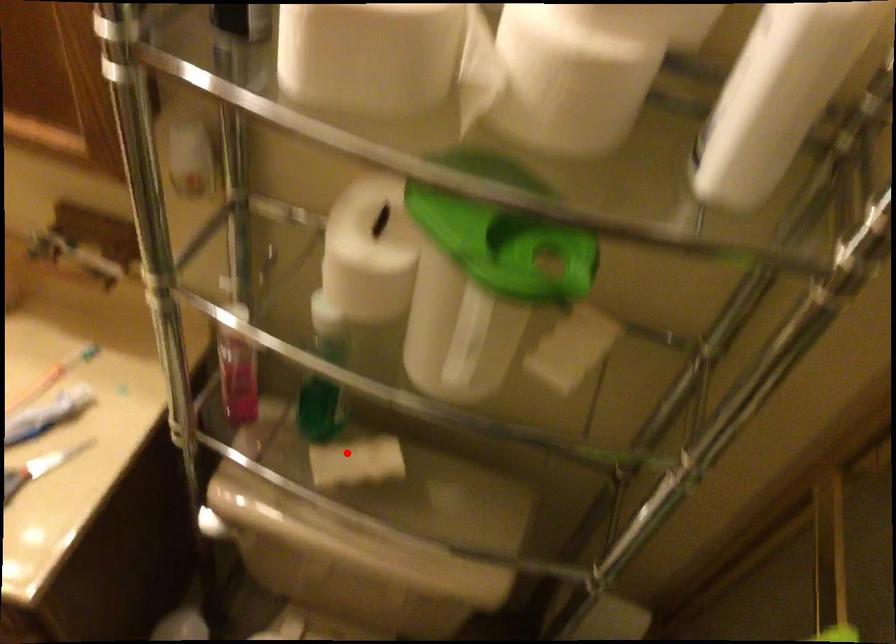
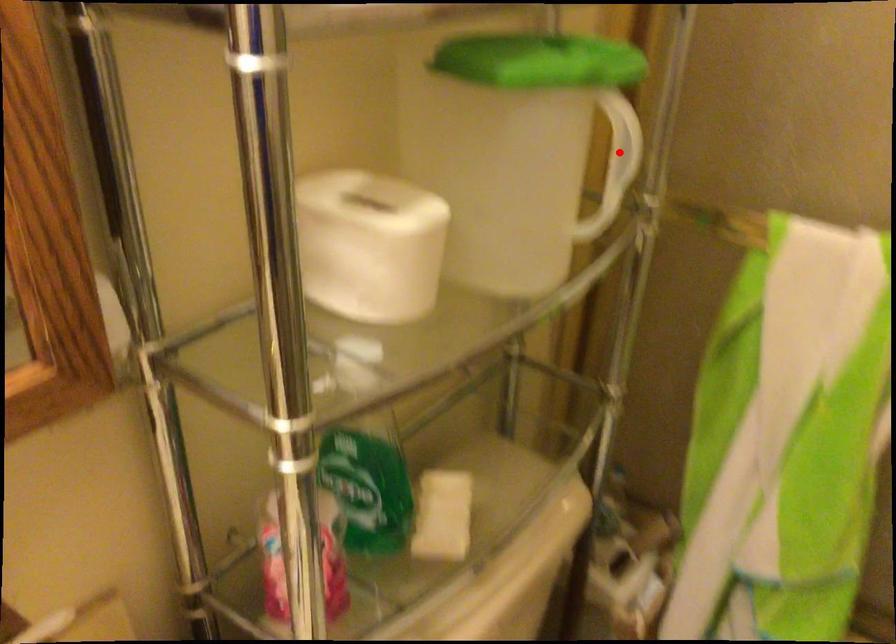
I am providing you with two images of the same scene from different viewpoints. A red point is marked on the first image and another point is marked on the second image. Are the points marked in image1 and image2 representing the same 3D position?

No